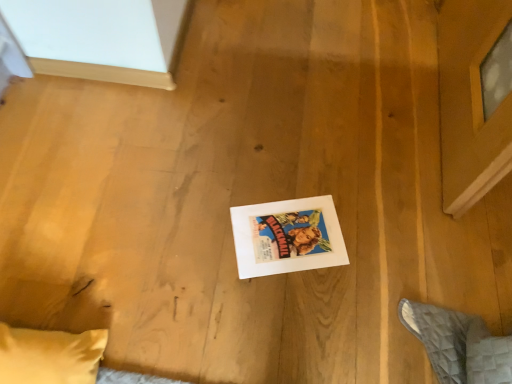
This screenshot has height=384, width=512. Identify the location of free spot below white paper at center (from a real-world perspective). (288, 240).